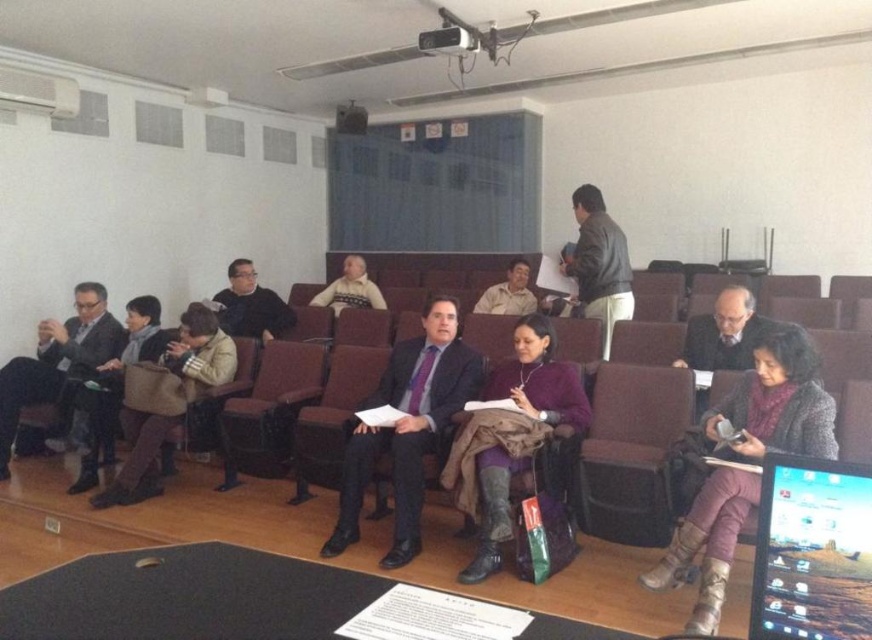
You are sitting in the second row of the conference room and notice two points marked on the floor. The first point is at coordinate point (269, 340) and the second is at point (366, 301). If you want to walk towards the front of the room, which point should you step on first?

You should step on point (269, 340) first because it is in front of point (366, 301), meaning it is closer to the front of the room.